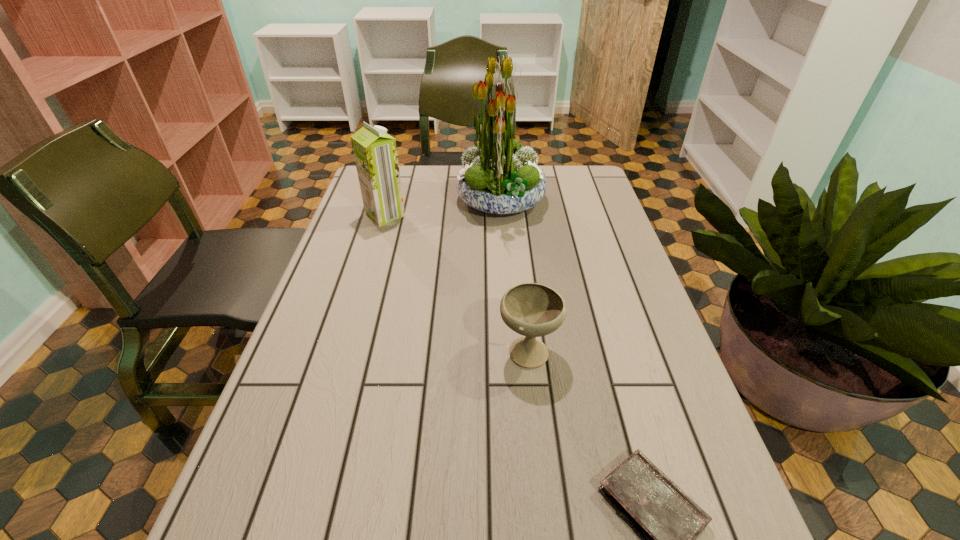
This screenshot has width=960, height=540. In order to click on free space between the leftmost object and the third farthest object in this screenshot , I will do `click(457, 282)`.

Select which object is the second closest to the soya milk. Please provide its 2D coordinates. Your answer should be formatted as a tuple, i.e. [(x, y)], where the tuple contains the x and y coordinates of a point satisfying the conditions above.

[(533, 310)]

Identify the location of the second closest object relative to the leftmost object. (533, 310).

This screenshot has height=540, width=960. I want to click on vacant space that satisfies the following two spatial constraints: 1. on the front-facing side of the second nearest object; 2. on the right side of the flower arrangement, so click(511, 349).